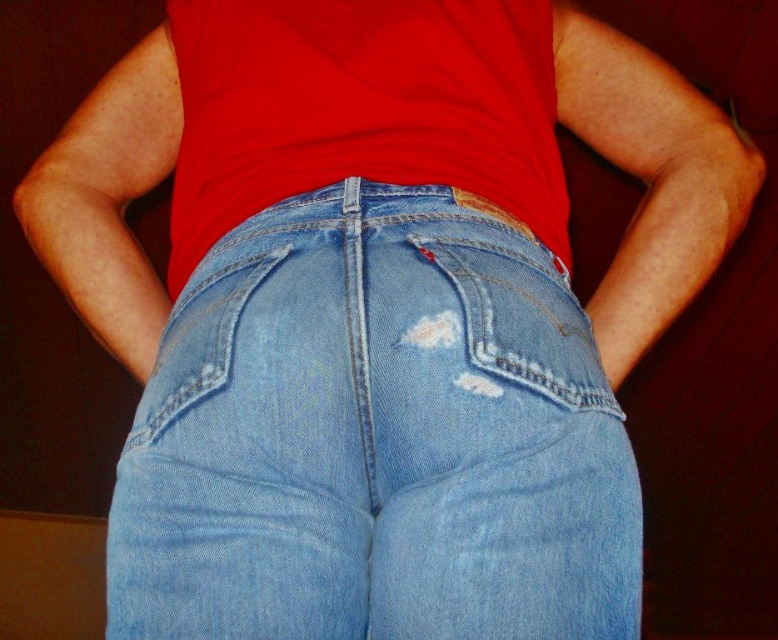
Question: Does matte red t-shirt at center have a greater width compared to ripped denim pocket at center?

Choices:
 (A) yes
 (B) no

Answer: (A)

Question: Estimate the real-world distances between objects in this image. Which object is closer to the matte red t-shirt at center?

Choices:
 (A) ripped denim pocket at center
 (B) light blue denim jeans at center

Answer: (B)

Question: Which point is farther to the camera?

Choices:
 (A) 395,515
 (B) 591,358

Answer: (B)

Question: Is light blue denim jeans at center below matte red t-shirt at center?

Choices:
 (A) no
 (B) yes

Answer: (B)

Question: Among these objects, which one is farthest from the camera?

Choices:
 (A) ripped denim pocket at center
 (B) light blue denim jeans at center

Answer: (A)

Question: Considering the relative positions of light blue denim jeans at center and matte red t-shirt at center in the image provided, where is light blue denim jeans at center located with respect to matte red t-shirt at center?

Choices:
 (A) right
 (B) left

Answer: (A)